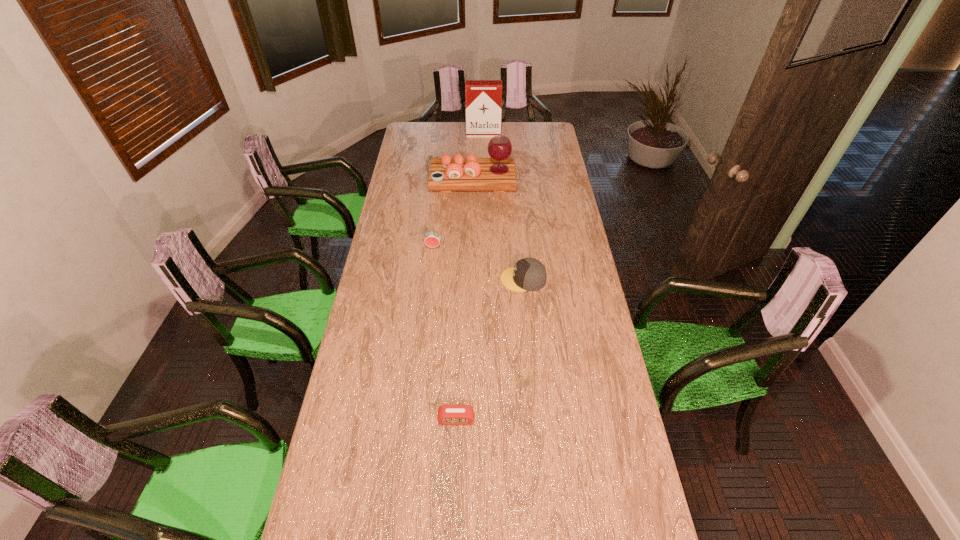
Locate an element on the screen. free spot located 0.380m on the front-facing side of the tallest object is located at coordinates (484, 172).

Where is `free space located on the right of the fourth nearest object`? Image resolution: width=960 pixels, height=540 pixels. free space located on the right of the fourth nearest object is located at coordinates (553, 179).

The image size is (960, 540). In order to click on vacant area situated on the face of the third nearest object in this screenshot , I will do `click(427, 303)`.

Locate an element on the screen. vacant space located 0.130m on the front-facing side of the second nearest object is located at coordinates (469, 279).

Where is `blank area located on the front-facing side of the second nearest object`? The image size is (960, 540). blank area located on the front-facing side of the second nearest object is located at coordinates pos(426,279).

Find the location of a particular element. The width and height of the screenshot is (960, 540). vacant space situated 0.160m on the front-facing side of the second nearest object is located at coordinates (462, 279).

Locate an element on the screen. Image resolution: width=960 pixels, height=540 pixels. vacant space positioned 0.160m on the front-facing side of the right alarm clock is located at coordinates (454, 478).

Where is `object at the far edge`? Image resolution: width=960 pixels, height=540 pixels. object at the far edge is located at coordinates (483, 97).

Find the location of a particular element. vacant space at the far edge is located at coordinates (435, 122).

This screenshot has width=960, height=540. What are the coordinates of `vacant space at the left edge of the desktop` in the screenshot? It's located at [x=396, y=246].